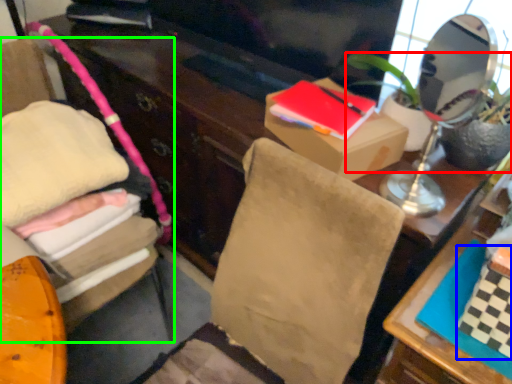
Question: Which object is the farthest from houseplant (highlighted by a red box)? Choose among these: book (highlighted by a blue box) or furniture (highlighted by a green box).

Choices:
 (A) book
 (B) furniture

Answer: (B)